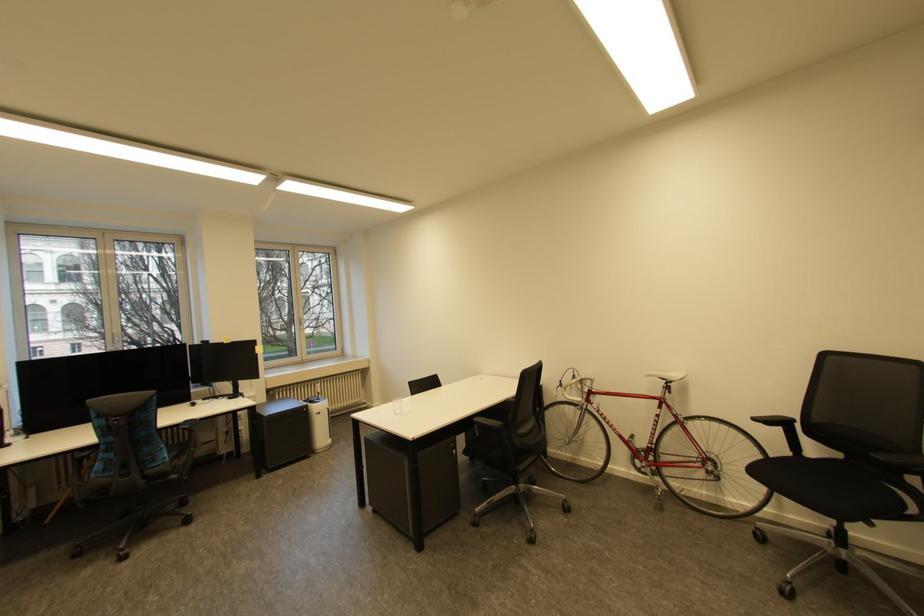
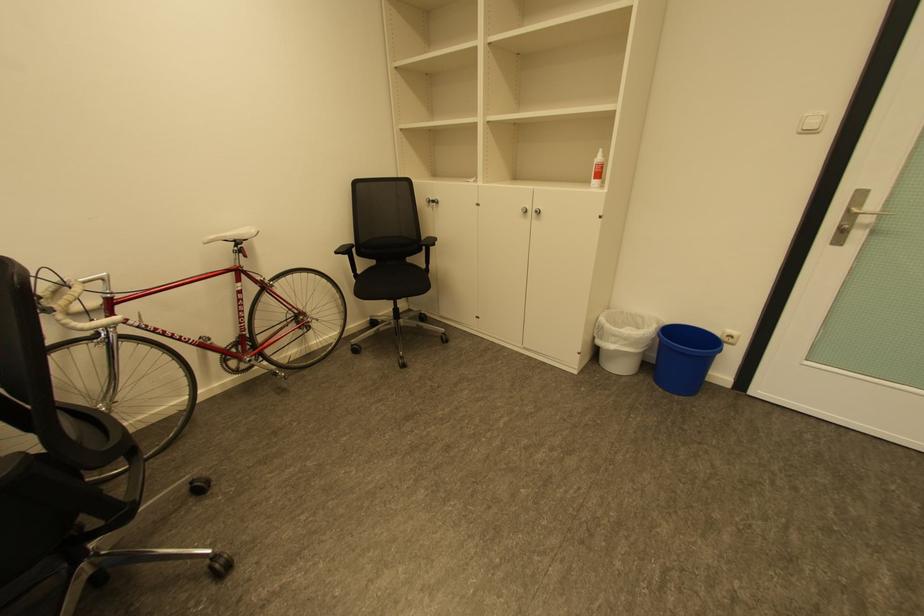
Locate, in the second image, the point that corresponds to (x=569, y=394) in the first image.

(70, 326)